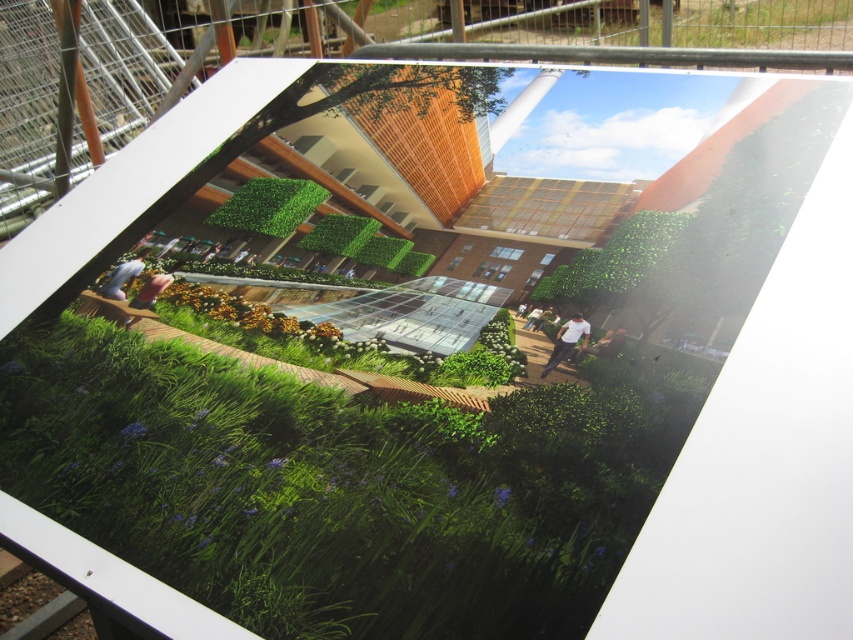
You are standing in front of the architectural rendering and see the green grass at center and the white cotton shirt at center. Which object is located to the left of the other?

The green grass at center is positioned on the left side of white cotton shirt at center, so the green grass at center is to the left of the white cotton shirt at center.

You are a visitor standing in front of the architectural rendering. You see the green grass at center and the white cotton shirt at center. Which object is closer to the front of the image?

The white cotton shirt at center is closer to the front of the image because it is positioned over the green grass at center, meaning the grass is behind it.

You are standing in front of the architectural rendering described. Where is the green grass at center located in the image?

The green grass at center is located at point coordinates of (x=337, y=486).